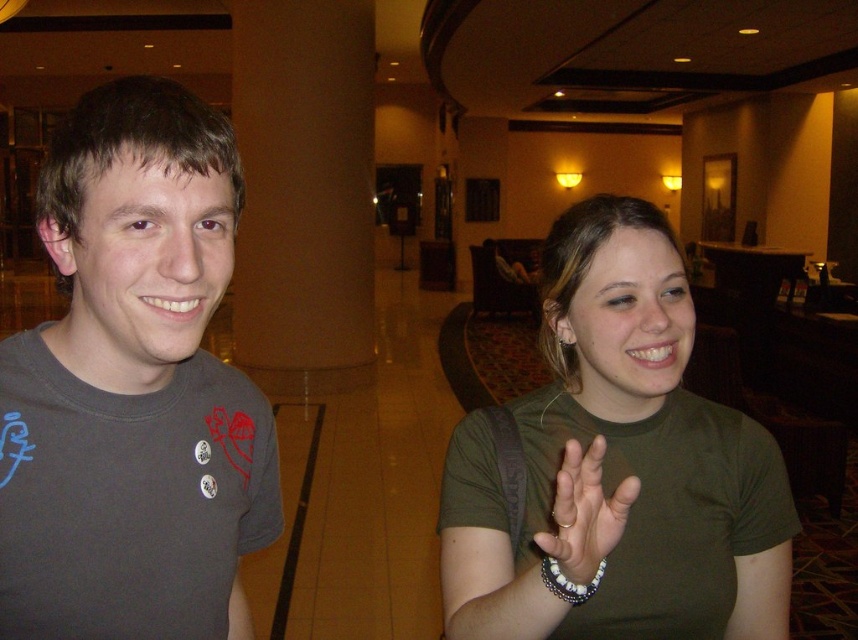
Does dark gray t-shirt at left come behind white beaded bracelet at lower right?

That is True.

Is dark gray t-shirt at left smaller than white beaded bracelet at lower right?

No, dark gray t-shirt at left is not smaller than white beaded bracelet at lower right.

Which is in front, point (47, 593) or point (571, 576)?

Point (571, 576)

Find the location of `dark gray t-shirt at left`. dark gray t-shirt at left is located at coordinates (133, 387).

Image resolution: width=858 pixels, height=640 pixels. Describe the element at coordinates (618, 467) in the screenshot. I see `green matte shirt at center` at that location.

Is green matte shirt at center smaller than white beaded bracelet at lower right?

No.

Locate an element on the screen. This screenshot has width=858, height=640. green matte shirt at center is located at coordinates (618, 467).

Between dark gray t-shirt at left and green matte shirt at center, which one is positioned higher?

dark gray t-shirt at left is higher up.

Can you confirm if dark gray t-shirt at left is positioned below green matte shirt at center?

Actually, dark gray t-shirt at left is above green matte shirt at center.

Image resolution: width=858 pixels, height=640 pixels. What are the coordinates of `dark gray t-shirt at left` in the screenshot? It's located at (133, 387).

The height and width of the screenshot is (640, 858). I want to click on dark gray t-shirt at left, so (x=133, y=387).